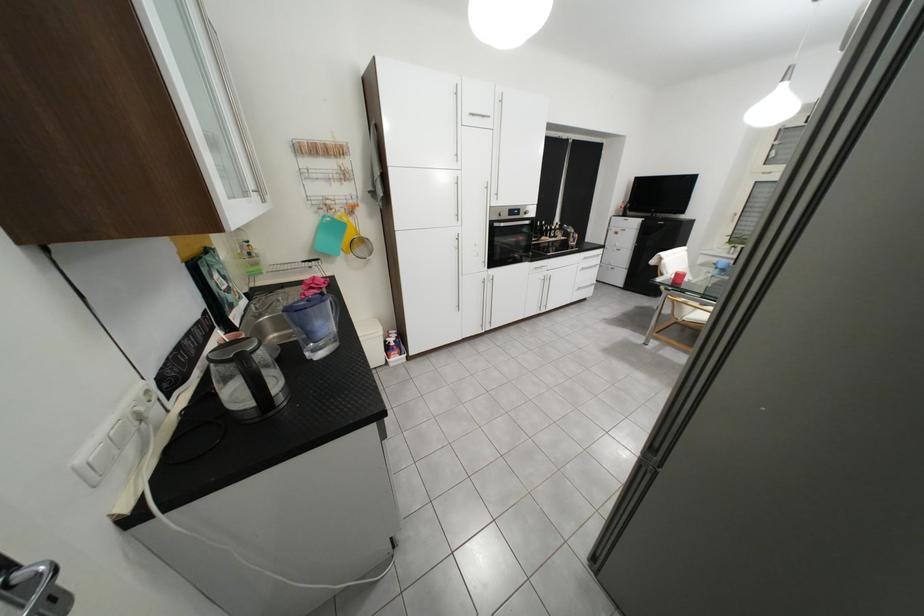
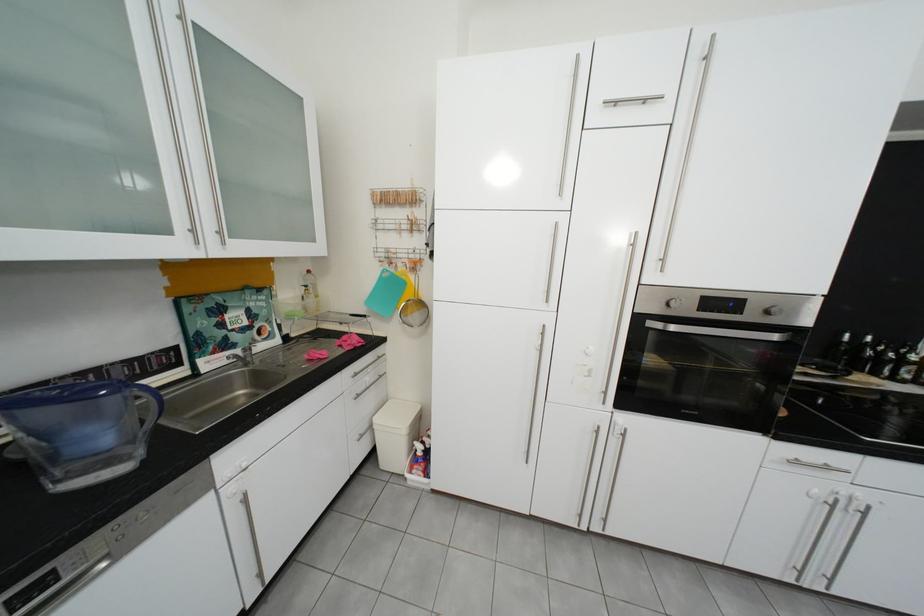
Locate, in the second image, the point that corresponds to [512,216] in the first image.

(679, 306)